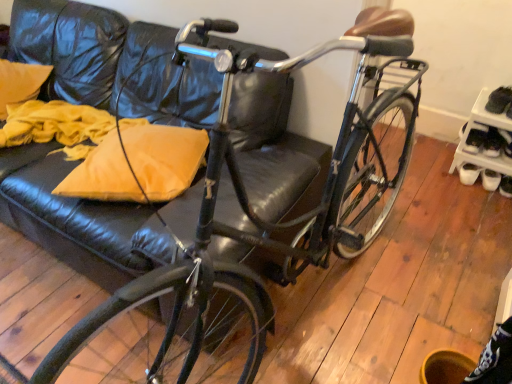
Locate an element on the screen. This screenshot has width=512, height=384. vacant space to the left of black leather shoe at lower right is located at coordinates (481, 193).